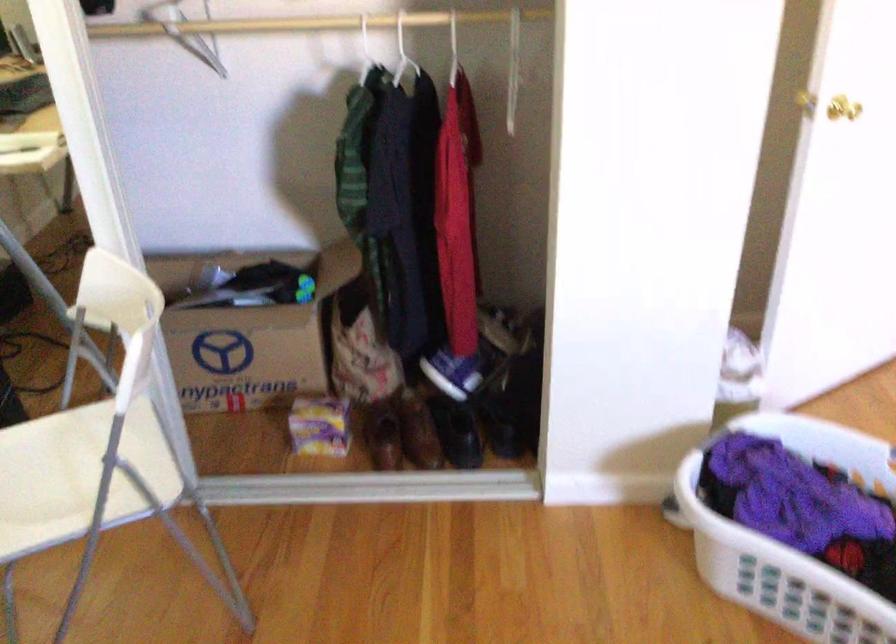
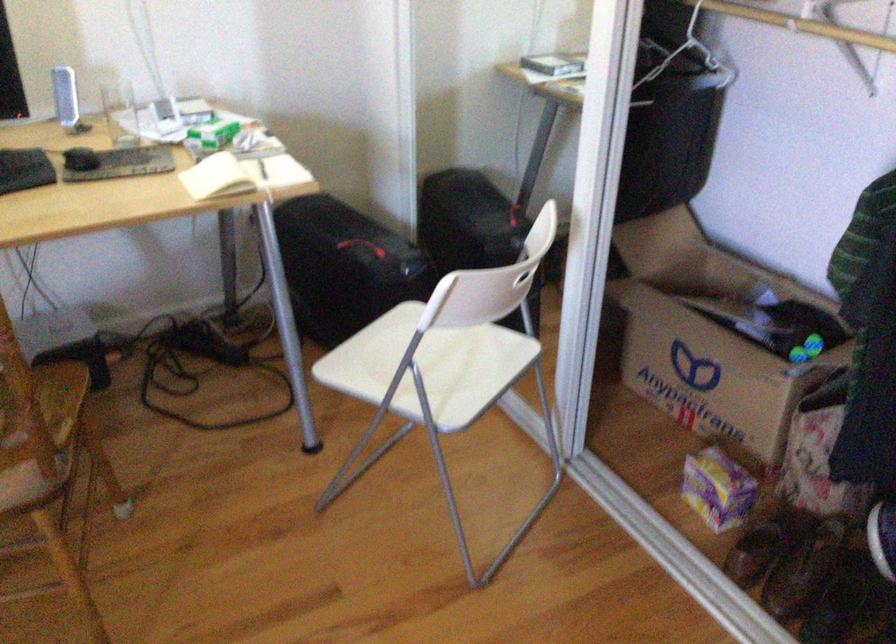
Locate, in the second image, the point that corresponds to point 152,298 in the first image.

(528, 269)